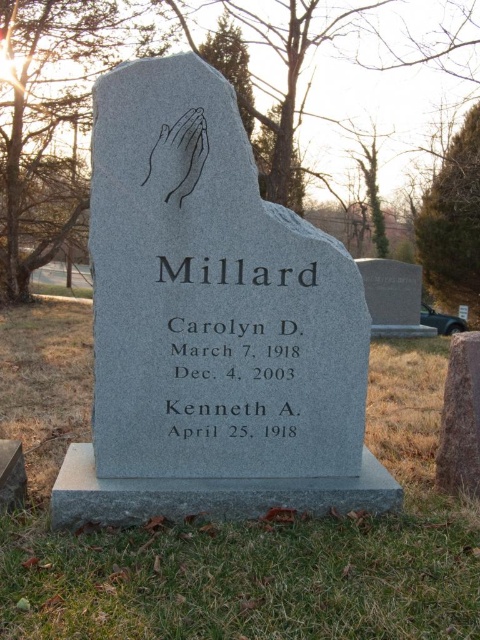
You are standing in a cemetery and want to find the gray granite gravestone at lower right. From your current position facing the gray granite monument at center, which direction should you turn to locate it?

The gray granite gravestone at lower right is to the right of the gray granite monument at center, so you should turn to your right to locate it.